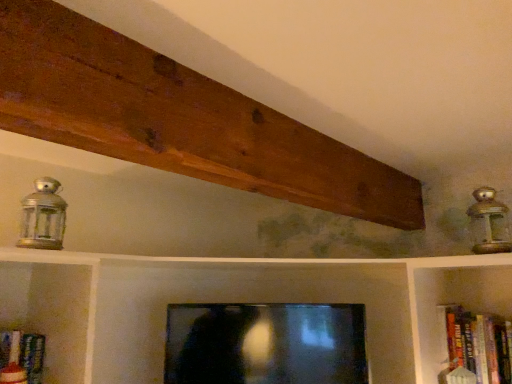
Question: Can you confirm if hardcover book at right is taller than matte black tv at center?

Choices:
 (A) yes
 (B) no

Answer: (B)

Question: Is hardcover book at right wider than matte black tv at center?

Choices:
 (A) no
 (B) yes

Answer: (A)

Question: Is hardcover book at right thinner than matte black tv at center?

Choices:
 (A) no
 (B) yes

Answer: (B)

Question: Is matte black tv at center inside hardcover book at right?

Choices:
 (A) yes
 (B) no

Answer: (B)

Question: Is hardcover book at right oriented towards matte black tv at center?

Choices:
 (A) yes
 (B) no

Answer: (B)

Question: From the image's perspective, would you say hardcover book at right is positioned over matte black tv at center?

Choices:
 (A) no
 (B) yes

Answer: (B)

Question: From the image's perspective, is matte black tv at center above metallic lantern at upper right, which is the 2th lamp in left-to-right order?

Choices:
 (A) yes
 (B) no

Answer: (B)

Question: Does matte black tv at center have a lesser width compared to metallic lantern at upper right, which ranks as the first lamp in right-to-left order?

Choices:
 (A) no
 (B) yes

Answer: (A)

Question: Is the depth of matte black tv at center less than that of metallic lantern at upper right, which is the 2th lamp in left-to-right order?

Choices:
 (A) no
 (B) yes

Answer: (A)

Question: From a real-world perspective, is matte black tv at center beneath metallic lantern at upper right, which is the 2th lamp in left-to-right order?

Choices:
 (A) yes
 (B) no

Answer: (A)

Question: Can you confirm if matte black tv at center is positioned to the right of metallic lantern at upper right, which ranks as the first lamp in right-to-left order?

Choices:
 (A) yes
 (B) no

Answer: (B)

Question: Is matte black tv at center smaller than metallic lantern at upper right, which is the 2th lamp in left-to-right order?

Choices:
 (A) no
 (B) yes

Answer: (A)

Question: Would you say metallic lantern at upper right, which ranks as the first lamp in right-to-left order, is outside brown wood plank at upper center?

Choices:
 (A) yes
 (B) no

Answer: (A)